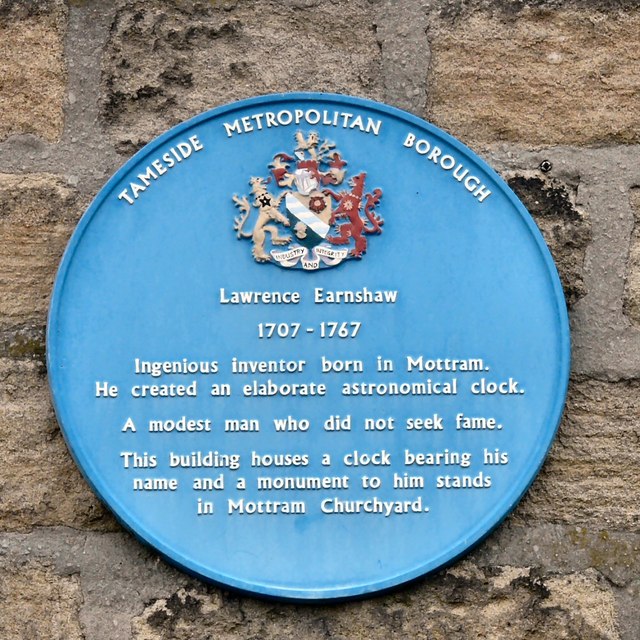
This screenshot has width=640, height=640. I want to click on screw in wall, so click(548, 166).